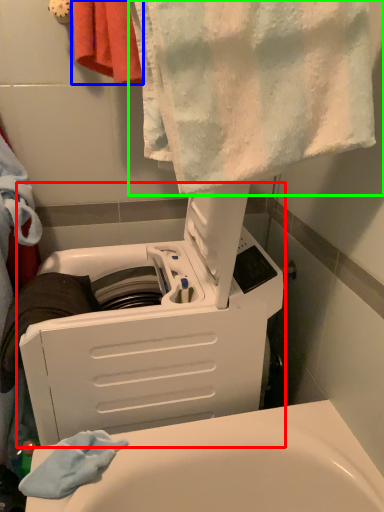
Question: Which object is positioned farthest from appliance (highlighted by a red box)? Select from towel (highlighted by a blue box) and towel (highlighted by a green box).

Choices:
 (A) towel
 (B) towel

Answer: (A)